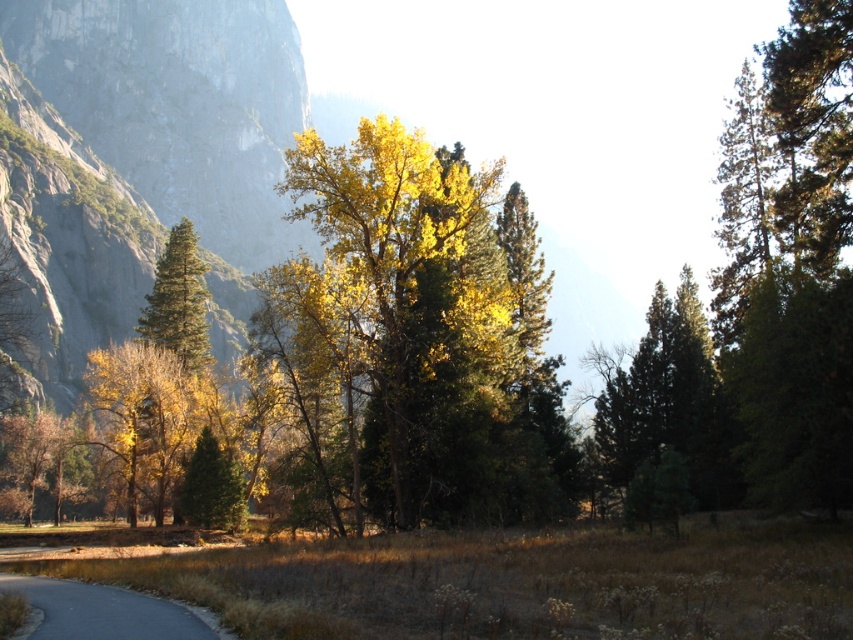
You are standing at the starting point of the trail and see the gray asphalt road at lower left and the green matte tree at center. Which object is nearer to you?

The gray asphalt road at lower left is closer to the viewer than the green matte tree at center.

You are standing at the point marked as point (405, 332) in the image. What color of the foliage are you surrounded by?

The point (405, 332) is on yellow green foliage at center, so you are surrounded by yellow green foliage.